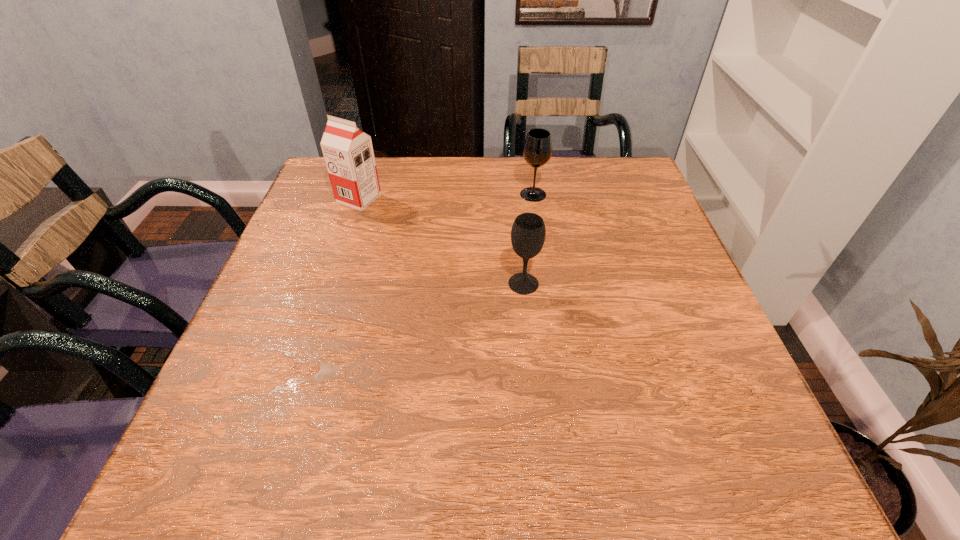
The height and width of the screenshot is (540, 960). I want to click on object located in the far left corner section of the desktop, so click(x=348, y=152).

Identify the location of free space at the far edge of the desktop. The height and width of the screenshot is (540, 960). (479, 192).

Locate an element on the screen. This screenshot has height=540, width=960. free space at the near edge is located at coordinates (537, 465).

Locate an element on the screen. vacant space at the left edge of the desktop is located at coordinates (311, 276).

This screenshot has height=540, width=960. Identify the location of vacant area at the right edge of the desktop. (704, 346).

In order to click on free region at the far left corner of the desktop in this screenshot , I will do `click(323, 194)`.

Find the location of `free space at the near left corner of the desktop`. free space at the near left corner of the desktop is located at coordinates (283, 442).

The image size is (960, 540). What are the coordinates of `vacant space at the far right corner of the desktop` in the screenshot? It's located at (595, 192).

I want to click on unoccupied area between the farther wineglass and the soya milk, so click(446, 197).

Identify the location of vacant region between the farther wineglass and the soya milk. This screenshot has width=960, height=540. (446, 197).